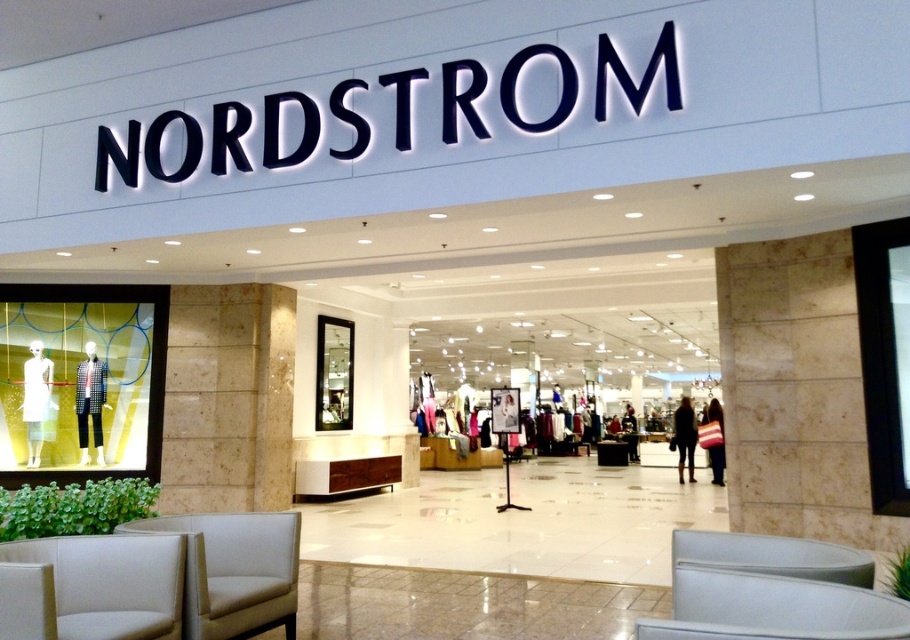
Question: Which object is positioned farthest from the dark brown leather jacket at center?

Choices:
 (A) white fabric armchair at lower left
 (B) white leather armchair at lower left

Answer: (A)

Question: Which object is farther from the camera taking this photo?

Choices:
 (A) white leather armchair at lower left
 (B) dark brown leather jacket at center
 (C) white fabric armchair at lower left

Answer: (B)

Question: Does white fabric armchair at lower left have a greater width compared to dark brown leather jacket at center?

Choices:
 (A) no
 (B) yes

Answer: (A)

Question: In this image, where is white leather armchair at lower left located relative to dark brown leather jacket at center?

Choices:
 (A) above
 (B) below

Answer: (A)

Question: Is white fabric armchair at lower left above dark brown leather jacket at center?

Choices:
 (A) yes
 (B) no

Answer: (A)

Question: Which object is the farthest from the dark brown leather jacket at center?

Choices:
 (A) white fabric armchair at lower left
 (B) white leather armchair at lower left

Answer: (A)